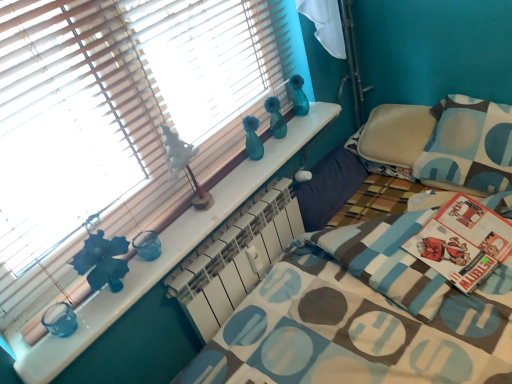
Question: Would you say white matte table lamp at upper center is outside wooden blinds at upper left?

Choices:
 (A) no
 (B) yes

Answer: (B)

Question: Considering the relative sizes of white matte table lamp at upper center and wooden blinds at upper left in the image provided, is white matte table lamp at upper center shorter than wooden blinds at upper left?

Choices:
 (A) yes
 (B) no

Answer: (A)

Question: Is there a large distance between white matte table lamp at upper center and wooden blinds at upper left?

Choices:
 (A) yes
 (B) no

Answer: (B)

Question: Is white matte table lamp at upper center closer to camera compared to wooden blinds at upper left?

Choices:
 (A) no
 (B) yes

Answer: (A)

Question: Considering the relative sizes of white matte table lamp at upper center and wooden blinds at upper left in the image provided, is white matte table lamp at upper center bigger than wooden blinds at upper left?

Choices:
 (A) no
 (B) yes

Answer: (A)

Question: Based on their positions, is wooden blinds at upper left located to the left or right of blue and white patterned pillow at right?

Choices:
 (A) right
 (B) left

Answer: (B)

Question: Do you think wooden blinds at upper left is within blue and white patterned pillow at right, or outside of it?

Choices:
 (A) inside
 (B) outside

Answer: (B)

Question: Is point (117, 28) closer or farther from the camera than point (429, 145)?

Choices:
 (A) closer
 (B) farther

Answer: (A)

Question: Is wooden blinds at upper left in front of or behind blue and white patterned pillow at right in the image?

Choices:
 (A) behind
 (B) front

Answer: (B)

Question: From a real-world perspective, is white matte radiator at center above or below white matte table lamp at upper center?

Choices:
 (A) below
 (B) above

Answer: (A)

Question: Is white matte radiator at center bigger or smaller than white matte table lamp at upper center?

Choices:
 (A) big
 (B) small

Answer: (A)

Question: From the image's perspective, is white matte radiator at center positioned above or below white matte table lamp at upper center?

Choices:
 (A) above
 (B) below

Answer: (B)

Question: In terms of height, does white matte radiator at center look taller or shorter compared to white matte table lamp at upper center?

Choices:
 (A) tall
 (B) short

Answer: (A)

Question: From a real-world perspective, is white matte radiator at center physically located above or below blue and white patterned pillow at right?

Choices:
 (A) above
 (B) below

Answer: (B)

Question: Is white matte radiator at center situated inside blue and white patterned pillow at right or outside?

Choices:
 (A) inside
 (B) outside

Answer: (B)